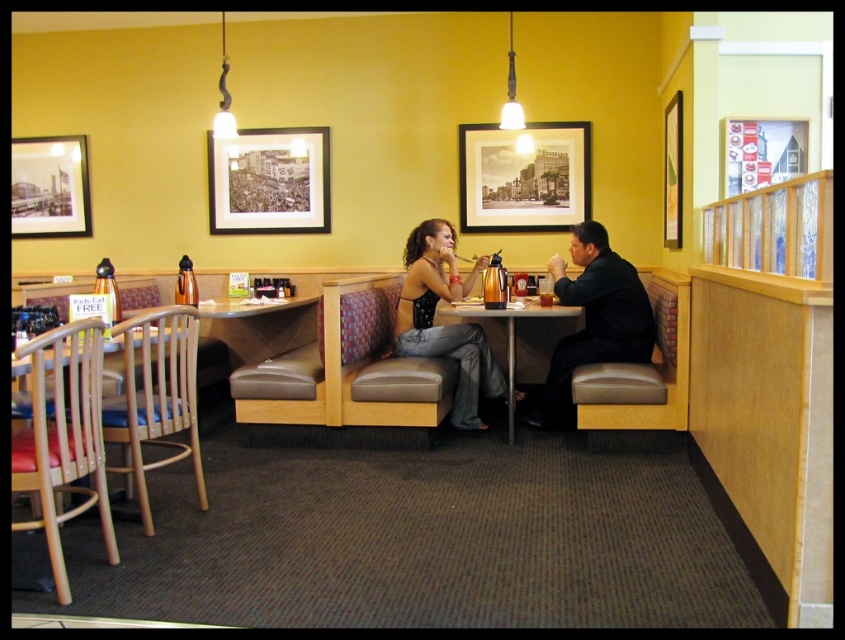
Question: Which of these objects is positioned farthest from the black leather jacket at center?

Choices:
 (A) black matte picture frame at upper center
 (B) matte black tank top at center
 (C) wooden table at center

Answer: (A)

Question: Can you confirm if matte black frame at center is smaller than black matte picture frame at upper left?

Choices:
 (A) yes
 (B) no

Answer: (B)

Question: Is matte black frame at center to the right of matte black tank top at center from the viewer's perspective?

Choices:
 (A) no
 (B) yes

Answer: (B)

Question: Based on their relative distances, which object is nearer to the matte black dress at center?

Choices:
 (A) matte black frame at center
 (B) black matte picture frame at upper center
 (C) wooden table at center

Answer: (C)

Question: Which object is closer to the camera taking this photo?

Choices:
 (A) black leather jacket at center
 (B) wooden table at center
 (C) black matte picture frame at upper left

Answer: (B)

Question: From the image, what is the correct spatial relationship of matte black dress at center in relation to black leather jacket at center?

Choices:
 (A) below
 (B) above

Answer: (B)